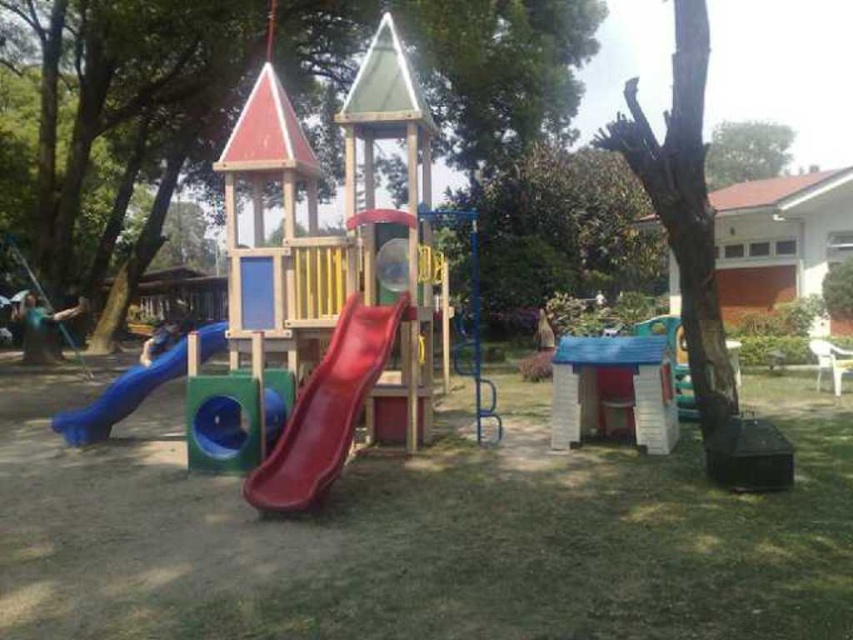
Does point (492, 220) lie behind point (177, 321)?

No.

Is green leafy tree at center to the right of blue rubber slide at center from the viewer's perspective?

Correct, you'll find green leafy tree at center to the right of blue rubber slide at center.

Which is behind, point (488, 252) or point (146, 356)?

Positioned behind is point (488, 252).

At what (x,y) coordinates should I click in order to perform the action: click on green leafy tree at center. Please return your answer as a coordinate pair (x, y). The image size is (853, 640). Looking at the image, I should click on (560, 230).

Between point (511, 54) and point (689, 289), which one is positioned in front?

Point (689, 289)

Is brown wood tree at center in front of brown rough bark tree at center?

No, brown wood tree at center is further to the viewer.

What do you see at coordinates (126, 92) in the screenshot?
I see `brown wood tree at center` at bounding box center [126, 92].

Where is `brown wood tree at center`? brown wood tree at center is located at coordinates (126, 92).

This screenshot has width=853, height=640. What do you see at coordinates (326, 410) in the screenshot?
I see `rubber smooth slide at center` at bounding box center [326, 410].

Which is in front, point (361, 378) or point (152, 336)?

Point (361, 378)

This screenshot has width=853, height=640. What are the coordinates of `rubber smooth slide at center` in the screenshot? It's located at (326, 410).